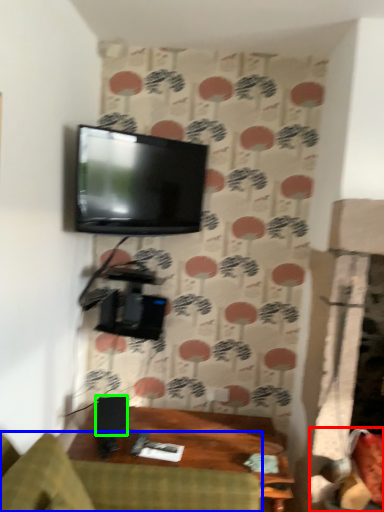
Question: Which object is positioned farthest from swivel chair (highlighted by a red box)? Select from studio couch (highlighted by a blue box) and speaker (highlighted by a green box).

Choices:
 (A) studio couch
 (B) speaker

Answer: (B)